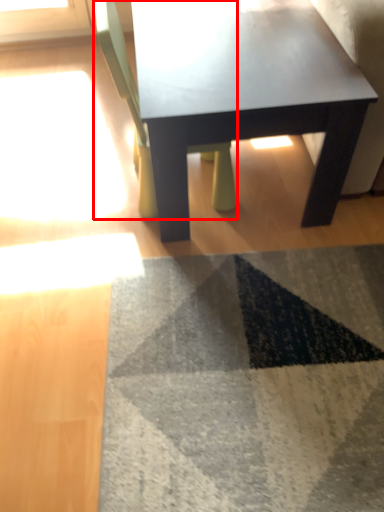
Question: From the image's perspective, what is the correct spatial positioning of chair (annotated by the red box) in reference to coffee table?

Choices:
 (A) above
 (B) below

Answer: (B)